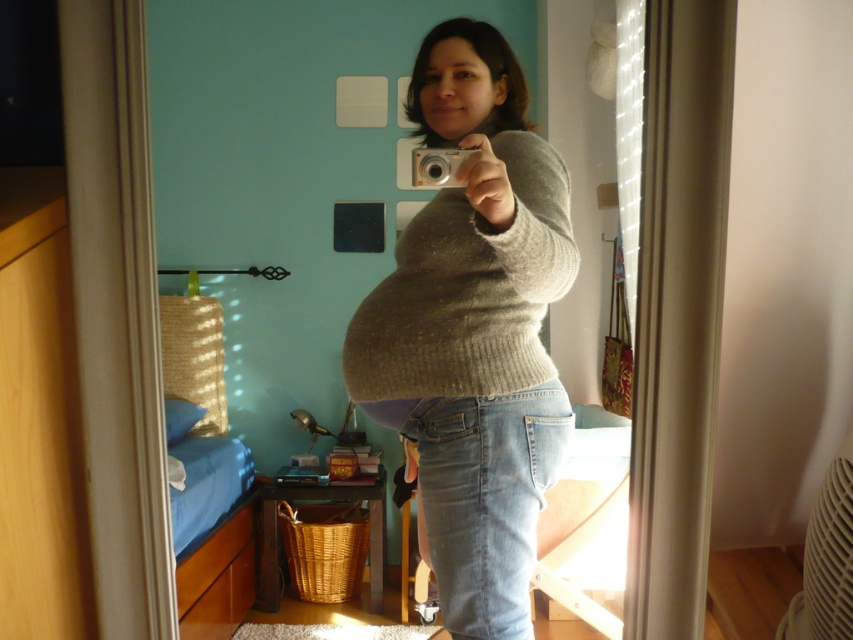
Question: Which point appears closest to the camera in this image?

Choices:
 (A) [280, 65]
 (B) [438, 490]
 (C) [445, 176]

Answer: (C)

Question: Is gray knitted sweater at center below denim jeans at lower center?

Choices:
 (A) yes
 (B) no

Answer: (B)

Question: Which of the following is the closest to the observer?

Choices:
 (A) (372, 406)
 (B) (462, 392)
 (C) (511, 168)

Answer: (C)

Question: Which of the following is the farthest from the observer?

Choices:
 (A) knitted sweater at center
 (B) gray knitted sweater at center

Answer: (B)

Question: Does gray knitted sweater at center have a larger size compared to matte beige sweater at center?

Choices:
 (A) no
 (B) yes

Answer: (B)

Question: Observing the image, what is the correct spatial positioning of silver metallic camera at center in reference to matte beige sweater at center?

Choices:
 (A) below
 (B) above

Answer: (B)